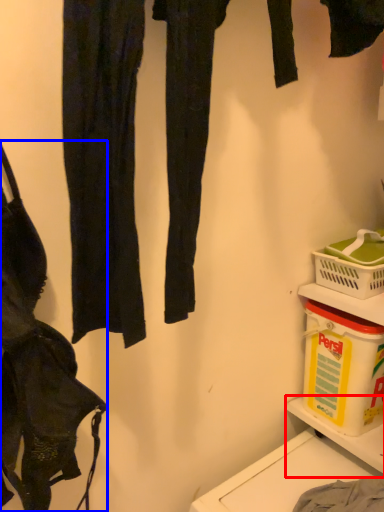
Question: Among these objects, which one is farthest to the camera, shelf (highlighted by a red box) or handbag (highlighted by a blue box)?

Choices:
 (A) shelf
 (B) handbag

Answer: (A)